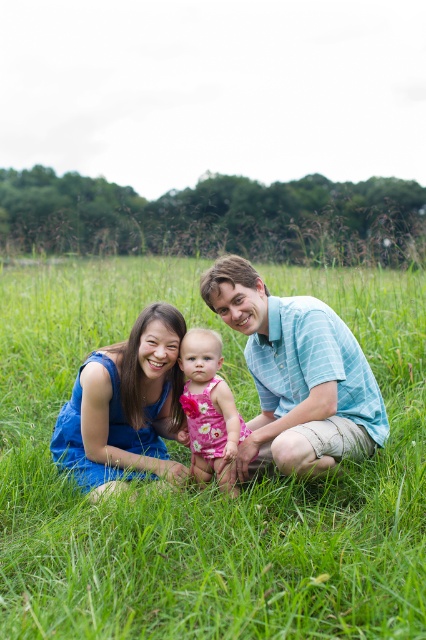
How far apart are blue fabric dress at center and pink floral dress at center?

blue fabric dress at center is 27.94 centimeters away from pink floral dress at center.

Between blue fabric dress at center and pink floral dress at center, which one is positioned lower?

pink floral dress at center

Between point (169, 346) and point (219, 392), which one is positioned in front?

Point (219, 392) is in front.

Identify the location of blue fabric dress at center. (126, 406).

Does green grass at center lie in front of pink floral dress at center?

Yes, green grass at center is closer to the viewer.

Is point (420, 604) farther from camera compared to point (213, 458)?

That is False.

Which is behind, point (48, 621) or point (199, 406)?

Point (199, 406)

I want to click on green grass at center, so [x=210, y=486].

Which of these two, blue striped shirt at center or pink floral dress at center, stands taller?

blue striped shirt at center is taller.

Who is more forward, (255, 424) or (190, 380)?

Positioned in front is point (190, 380).

Where is `blue striped shirt at center`? The width and height of the screenshot is (426, 640). blue striped shirt at center is located at coordinates (296, 376).

Where is `blue striped shirt at center`? This screenshot has width=426, height=640. blue striped shirt at center is located at coordinates (296, 376).